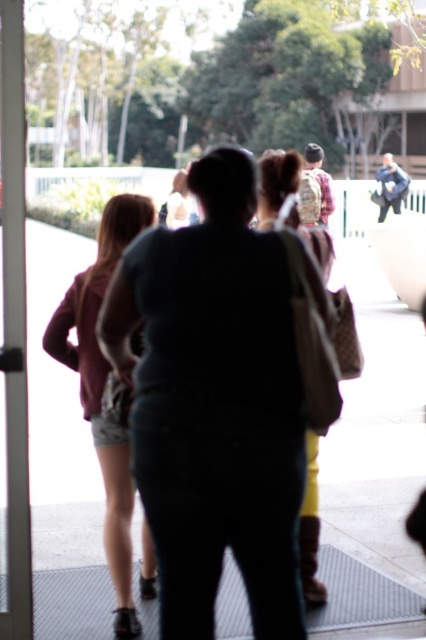
You are standing inside a building and see the white glossy door at left and the matte beige backpack at center. Which object is positioned to the left of the other?

The white glossy door at left is positioned to the left of the matte beige backpack at center.

You are standing inside the building looking out through the entrance. There are two people in the foreground wearing dark blue jeans at center and denim shorts at left. Which one is positioned more to the right side?

The dark blue jeans at center is positioned more to the right side than the denim shorts at left.

You are standing inside a building and want to exit through the white glossy door at left. There is a matte beige backpack at center in your way. Considering the height of both objects, can you walk through the door without bending down?

The white glossy door at left is taller than the matte beige backpack at center, so you can walk through the door without bending down because the door is taller than the backpack.